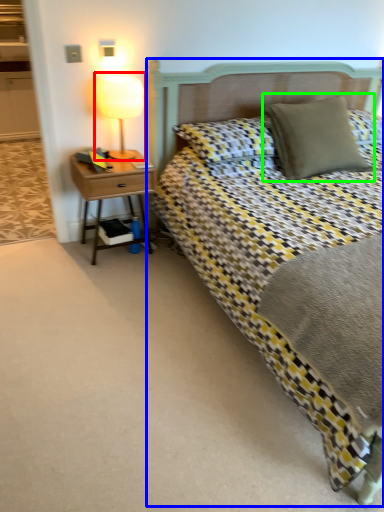
Question: Which object is the closest to the bedside lamp (highlighted by a red box)? Choose among these: bed (highlighted by a blue box) or pillow (highlighted by a green box).

Choices:
 (A) bed
 (B) pillow

Answer: (A)